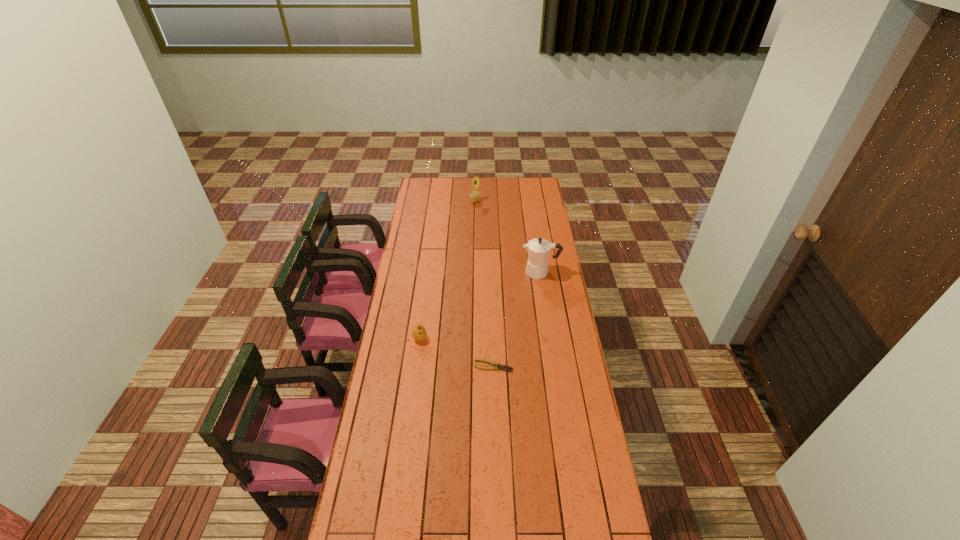
Locate an element on the screen. vacant area that satisfies the following two spatial constraints: 1. at the spout of the rightmost object; 2. on the front side of the second shortest object is located at coordinates (550, 339).